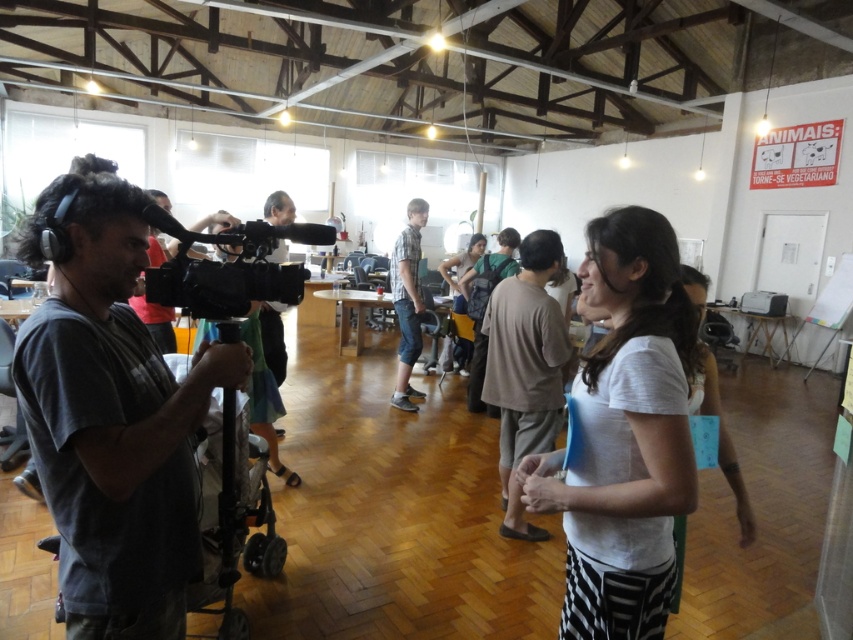
You are a photographer positioned in the workshop and need to take a photo of both the brown cotton shirt at center and the black plastic video camera at center. Which object should you focus on first to ensure both are in the frame?

You should focus on the brown cotton shirt at center first because it is closer to you than the black plastic video camera at center, ensuring both are in the frame.

Consider the image. You are organizing a photo shoot and need to arrange two shirts on a narrow table that can only accommodate one shirt at a time. The white cotton shirt at center and the plaid cotton shirt at center are both available. Which shirt should you choose to ensure it fits on the table?

The white cotton shirt at center might be wider than plaid cotton shirt at center, so to ensure it fits on the narrow table, you should choose the plaid cotton shirt at center.

You are a photographer standing in the workshop and want to take a photo of the brown cotton shirt at center and the black plastic video camera at center. Which object should you focus on first if you want to capture both in the same frame without moving the camera?

The brown cotton shirt at center is much taller than the black plastic video camera at center, so you should focus on the brown cotton shirt at center first to ensure it fits within the frame.